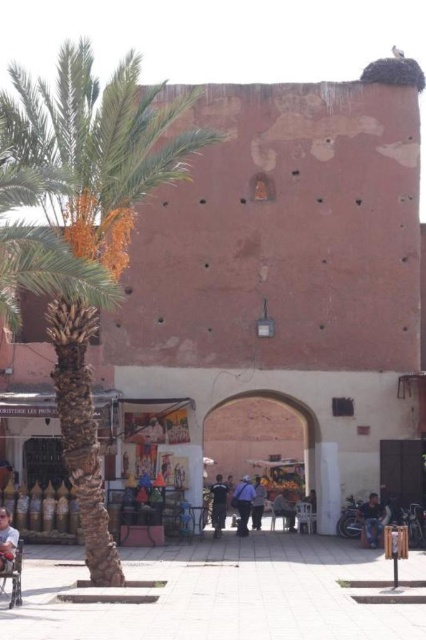
Question: Is brick archway at center positioned in front of jeans at center?

Choices:
 (A) no
 (B) yes

Answer: (A)

Question: Which point is farther from the camera taking this photo?

Choices:
 (A) (253, 458)
 (B) (278, 499)
 (C) (376, 538)
 (D) (247, 528)

Answer: (A)

Question: Is jeans at center further to the viewer compared to dark blue jeans at center?

Choices:
 (A) no
 (B) yes

Answer: (A)

Question: Which point is farther from the camera taking this photo?

Choices:
 (A) (374, 516)
 (B) (9, 534)
 (C) (287, 525)

Answer: (C)

Question: Estimate the real-world distances between objects in this image. Which object is closer to the dark blue uniform at center?

Choices:
 (A) jeans at center
 (B) blue uniformed person at center

Answer: (B)

Question: Is green leafy palm tree at left wider than jeans at center?

Choices:
 (A) yes
 (B) no

Answer: (A)